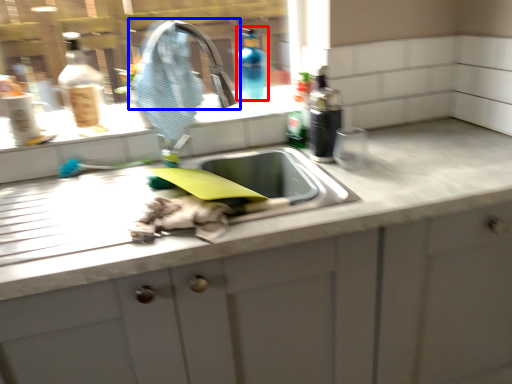
Question: Which point is further to the camera, bottle (highlighted by a red box) or tap (highlighted by a blue box)?

Choices:
 (A) bottle
 (B) tap

Answer: (A)